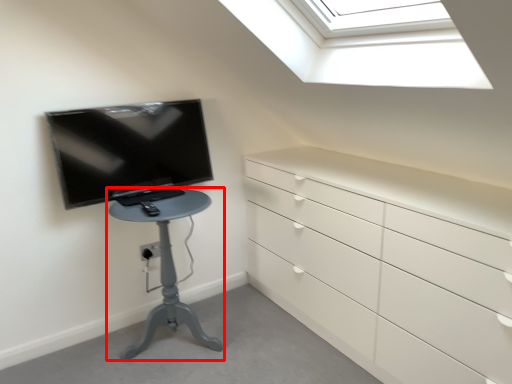
Question: From the image's perspective, what is the correct spatial relationship of furniture (annotated by the red box) in relation to television?

Choices:
 (A) below
 (B) above

Answer: (A)